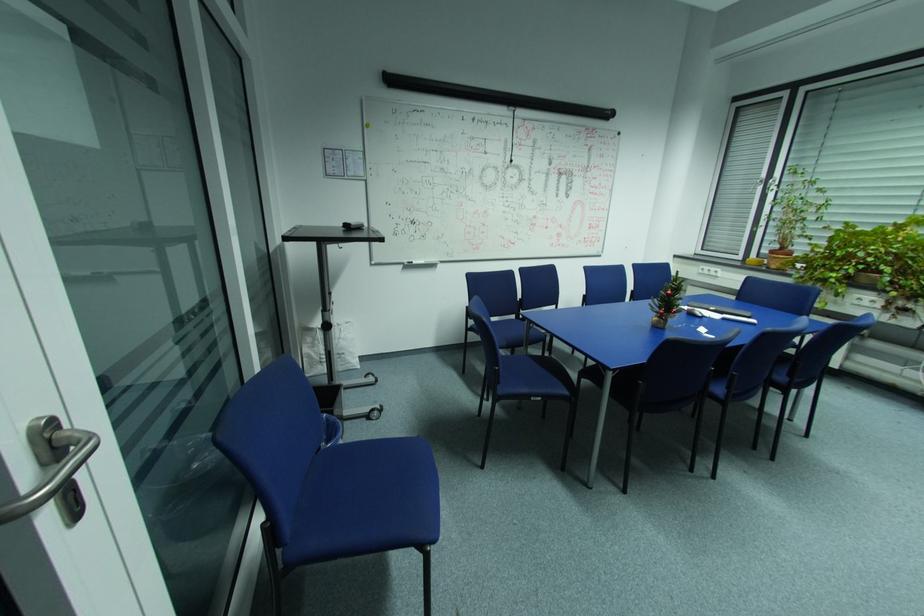
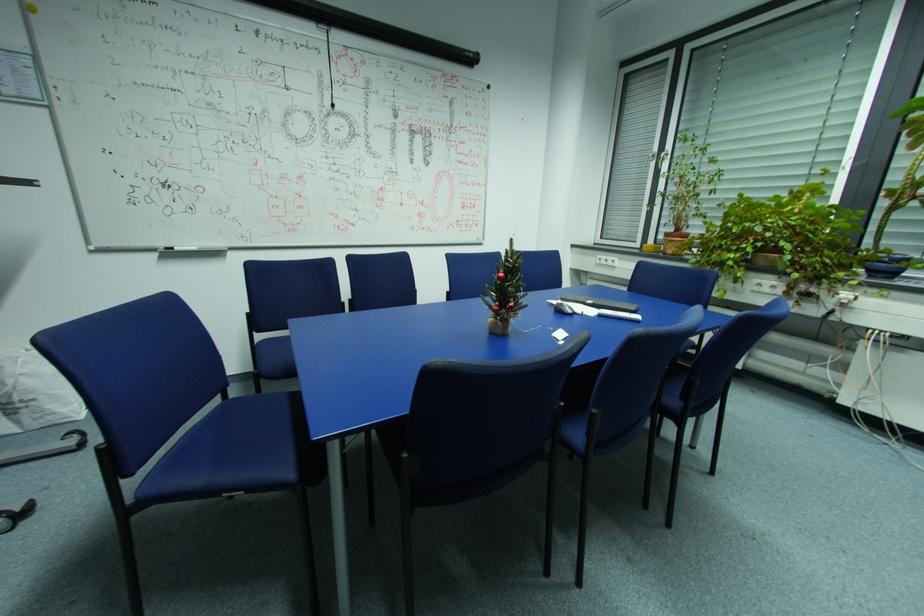
Which direction would the cameraman need to move to produce the second image?

The movement direction of the cameraman is right, forward.